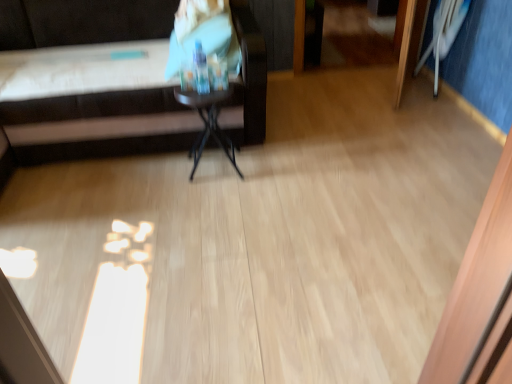
Question: Considering the positions of white plastic swivel chair at upper right and matte plastic bottle at upper center in the image, is white plastic swivel chair at upper right bigger or smaller than matte plastic bottle at upper center?

Choices:
 (A) small
 (B) big

Answer: (A)

Question: In terms of width, does white plastic swivel chair at upper right look wider or thinner when compared to matte plastic bottle at upper center?

Choices:
 (A) wide
 (B) thin

Answer: (B)

Question: Estimate the real-world distances between objects in this image. Which object is farther from the white plastic swivel chair at upper right?

Choices:
 (A) brown leather couch at upper left
 (B) black glossy side table at center
 (C) matte plastic bottle at upper center

Answer: (B)

Question: Which of these objects is positioned farthest from the matte plastic bottle at upper center?

Choices:
 (A) black glossy side table at center
 (B) brown leather couch at upper left
 (C) white plastic swivel chair at upper right

Answer: (C)